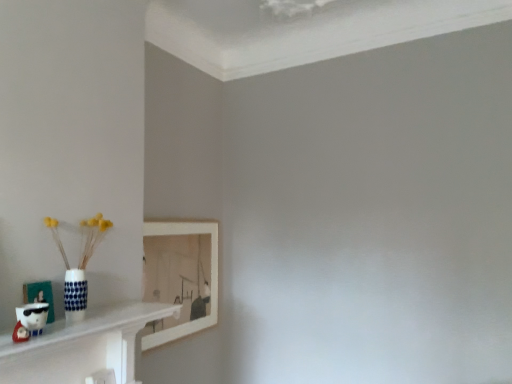
Question: Does white wooden picture frame at upper left, which appears as the 1th picture frame when viewed from the right, have a larger size compared to matte white picture frame at lower left, the second picture frame positioned from the back?

Choices:
 (A) yes
 (B) no

Answer: (A)

Question: Is white wooden picture frame at upper left, which appears as the 1th picture frame when viewed from the right, at the left side of matte white picture frame at lower left, the second picture frame positioned from the back?

Choices:
 (A) no
 (B) yes

Answer: (A)

Question: Is white wooden picture frame at upper left, which ranks as the first picture frame in back-to-front order, looking in the opposite direction of matte white picture frame at lower left, positioned as the 1th picture frame in front-to-back order?

Choices:
 (A) yes
 (B) no

Answer: (B)

Question: From the image's perspective, is white wooden picture frame at upper left, which appears as the 1th picture frame when viewed from the right, above matte white picture frame at lower left, the second picture frame positioned from the back?

Choices:
 (A) yes
 (B) no

Answer: (B)

Question: Is white wooden picture frame at upper left, which ranks as the first picture frame in back-to-front order, completely or partially outside of matte white picture frame at lower left, which appears as the 1th picture frame when viewed from the left?

Choices:
 (A) no
 (B) yes

Answer: (B)

Question: From the image's perspective, is white wooden picture frame at upper left, which appears as the 1th picture frame when viewed from the right, above or below white glossy shelf at lower left?

Choices:
 (A) below
 (B) above

Answer: (A)

Question: Relative to white glossy shelf at lower left, is white wooden picture frame at upper left, which is the 2th picture frame from left to right, in front or behind?

Choices:
 (A) behind
 (B) front

Answer: (A)

Question: Is white wooden picture frame at upper left, which appears as the 1th picture frame when viewed from the right, wider or thinner than white glossy shelf at lower left?

Choices:
 (A) thin
 (B) wide

Answer: (A)

Question: From a real-world perspective, is white wooden picture frame at upper left, which is the 2th picture frame in front-to-back order, positioned above or below white glossy shelf at lower left?

Choices:
 (A) above
 (B) below

Answer: (A)

Question: In terms of height, does white wooden picture frame at upper left, which appears as the 1th picture frame when viewed from the right, look taller or shorter compared to matte white picture frame at lower left, which is the second picture frame from right to left?

Choices:
 (A) short
 (B) tall

Answer: (B)

Question: Considering the positions of point (142, 344) and point (48, 288), is point (142, 344) closer or farther from the camera than point (48, 288)?

Choices:
 (A) closer
 (B) farther

Answer: (B)

Question: Relative to matte white picture frame at lower left, positioned as the 1th picture frame in front-to-back order, is white wooden picture frame at upper left, which ranks as the first picture frame in back-to-front order, in front or behind?

Choices:
 (A) behind
 (B) front

Answer: (A)

Question: From a real-world perspective, is white wooden picture frame at upper left, which is the 2th picture frame from left to right, above or below matte white picture frame at lower left, the second picture frame positioned from the back?

Choices:
 (A) below
 (B) above

Answer: (A)

Question: Would you say matte white picture frame at lower left, the second picture frame positioned from the back, is to the left or to the right of white glossy shelf at lower left in the picture?

Choices:
 (A) right
 (B) left

Answer: (B)

Question: From a real-world perspective, is matte white picture frame at lower left, which appears as the 1th picture frame when viewed from the left, positioned above or below white glossy shelf at lower left?

Choices:
 (A) above
 (B) below

Answer: (A)